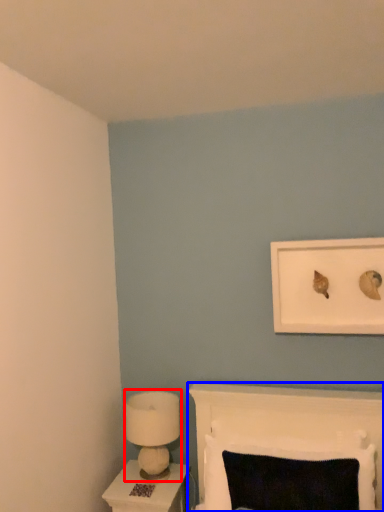
Question: Which point is closer to the camera, lamp (highlighted by a red box) or furniture (highlighted by a blue box)?

Choices:
 (A) lamp
 (B) furniture

Answer: (B)